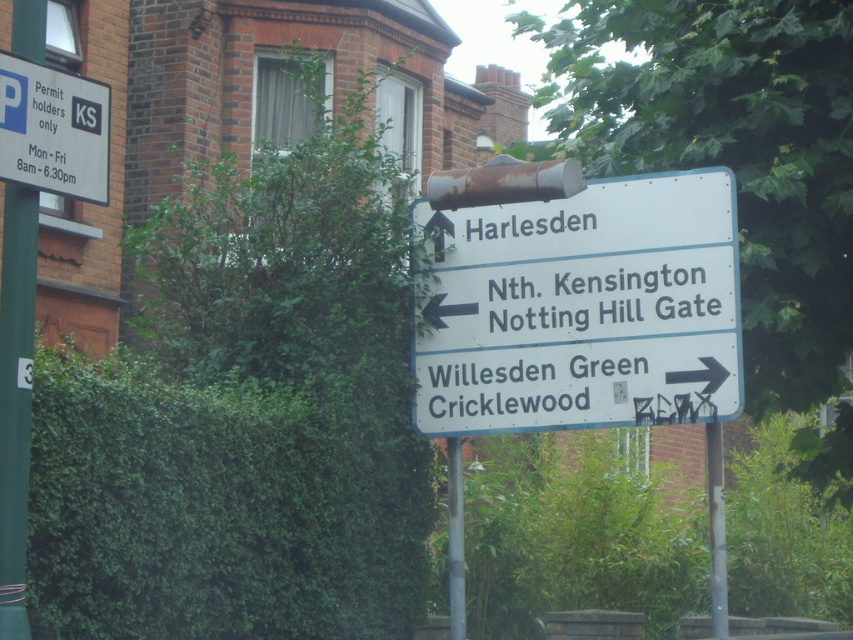
You are a delivery driver trying to park your van near the brick building with large windows. You see the green painted metal pole at left and the white plastic parking sign at upper left. According to the parking restrictions, can you park your van here?

The white plastic parking sign at upper left states that parking is restricted to permit holders only from Monday to Friday between 8am and 6.30pm. Since you are a delivery driver without a permit, you cannot park your van here during those times.